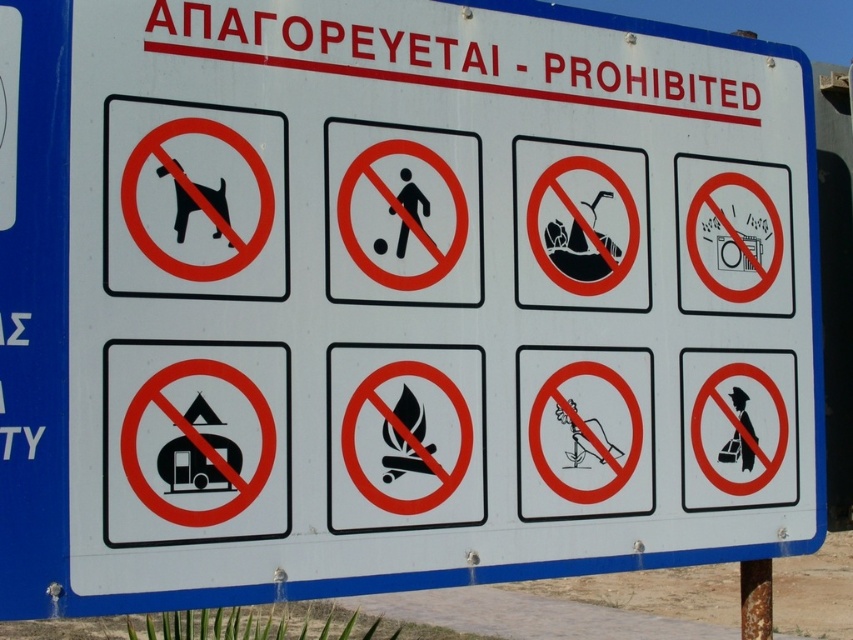
Question: Which object is closer to the camera taking this photo?

Choices:
 (A) black plastic dog at upper left
 (B) brown wooden pole at lower right

Answer: (A)

Question: Among these objects, which one is farthest from the camera?

Choices:
 (A) black plastic soccer ball at center
 (B) black plastic dog at upper left
 (C) brown wooden pole at lower right

Answer: (C)

Question: Does black plastic dog at upper left have a greater width compared to brown wooden pole at lower right?

Choices:
 (A) yes
 (B) no

Answer: (A)

Question: Which of these objects is positioned farthest from the black plastic soccer ball at center?

Choices:
 (A) brown wooden pole at lower right
 (B) black plastic dog at upper left

Answer: (A)

Question: Can you confirm if black plastic dog at upper left is positioned above brown wooden pole at lower right?

Choices:
 (A) no
 (B) yes

Answer: (B)

Question: Can you confirm if black plastic soccer ball at center is thinner than brown wooden pole at lower right?

Choices:
 (A) no
 (B) yes

Answer: (A)